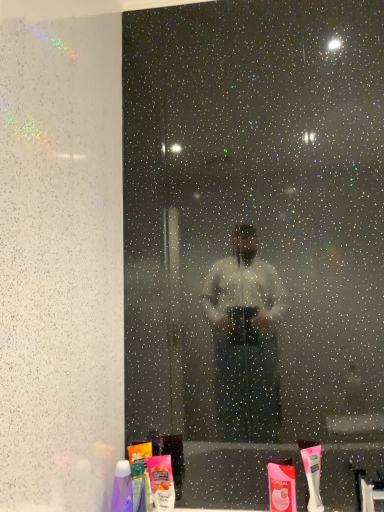
Question: Considering the positions of white plastic toothbrush at lower right and pink matte lotion at lower center, which is counted as the second toiletry, starting from the right, in the image, is white plastic toothbrush at lower right wider or thinner than pink matte lotion at lower center, which is counted as the second toiletry, starting from the right,?

Choices:
 (A) thin
 (B) wide

Answer: (B)

Question: Would you say white plastic toothbrush at lower right is to the left or to the right of pink matte lotion at lower center, marked as the second toiletry in a left-to-right arrangement, in the picture?

Choices:
 (A) left
 (B) right

Answer: (B)

Question: Which object is positioned farthest from the matte pink plastic toothpaste at lower center, which is the 3th toiletry from left to right?

Choices:
 (A) translucent plastic mouthwash at lower center
 (B) white plastic toothbrush at lower right
 (C) purple glossy bottle at lower left, arranged as the 1th toiletry when viewed from the left
 (D) pink matte lotion at lower center, marked as the second toiletry in a left-to-right arrangement

Answer: (C)

Question: Which of these objects is positioned closest to the purple glossy bottle at lower left, arranged as the 1th toiletry when viewed from the left?

Choices:
 (A) pink matte lotion at lower center, which is counted as the second toiletry, starting from the right
 (B) matte pink plastic toothpaste at lower center, arranged as the first toiletry when viewed from the right
 (C) translucent plastic mouthwash at lower center
 (D) white plastic toothbrush at lower right

Answer: (C)